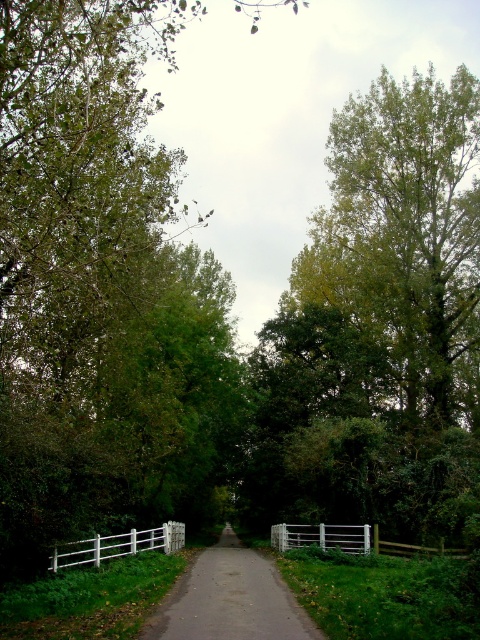
Question: Which of the following is the farthest from the observer?

Choices:
 (A) (72, 548)
 (B) (247, 561)

Answer: (B)

Question: Does white wooden fence at center appear on the left side of white wooden fence at lower left?

Choices:
 (A) no
 (B) yes

Answer: (A)

Question: Estimate the real-world distances between objects in this image. Which object is farther from the smooth asphalt driveway at center?

Choices:
 (A) white wooden fence at lower left
 (B) white wooden fence at center

Answer: (B)

Question: Can you confirm if smooth asphalt driveway at center is thinner than white wooden fence at lower left?

Choices:
 (A) yes
 (B) no

Answer: (B)

Question: Which point appears farthest from the camera in this image?

Choices:
 (A) (412, 547)
 (B) (182, 531)
 (C) (284, 632)

Answer: (B)

Question: Can you confirm if smooth asphalt driveway at center is positioned above white wooden fence at lower left?

Choices:
 (A) yes
 (B) no

Answer: (B)